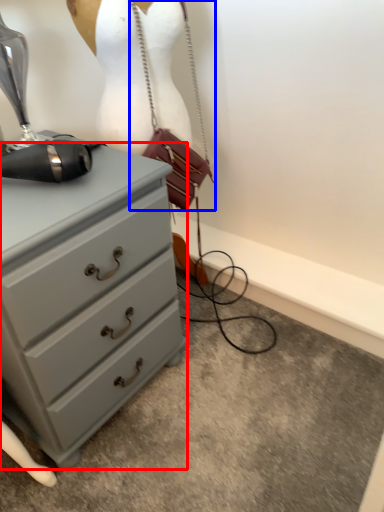
Question: Which of the following is the farthest to the observer, chest of drawers (highlighted by a red box) or handbag (highlighted by a blue box)?

Choices:
 (A) chest of drawers
 (B) handbag

Answer: (B)